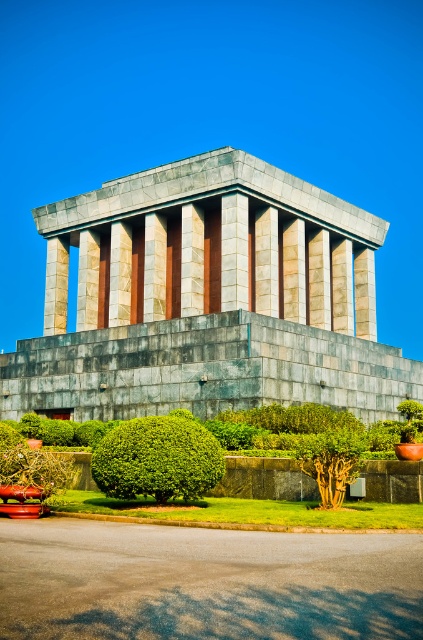
Question: Which object is positioned closest to the gray stone temple at center?

Choices:
 (A) green leafy tree at center
 (B) green leafy bush at center

Answer: (B)

Question: Is gray stone temple at center further to camera compared to green leafy tree at center?

Choices:
 (A) no
 (B) yes

Answer: (B)

Question: Does green leafy bush at center appear on the left side of green leafy tree at center?

Choices:
 (A) no
 (B) yes

Answer: (B)

Question: Which point appears closest to the camera in this image?

Choices:
 (A) (54, 390)
 (B) (202, 452)

Answer: (B)

Question: Which object is the farthest from the gray stone temple at center?

Choices:
 (A) green leafy bush at center
 (B) green leafy tree at center

Answer: (B)

Question: Can you confirm if gray stone temple at center is positioned to the right of green leafy bush at center?

Choices:
 (A) no
 (B) yes

Answer: (B)